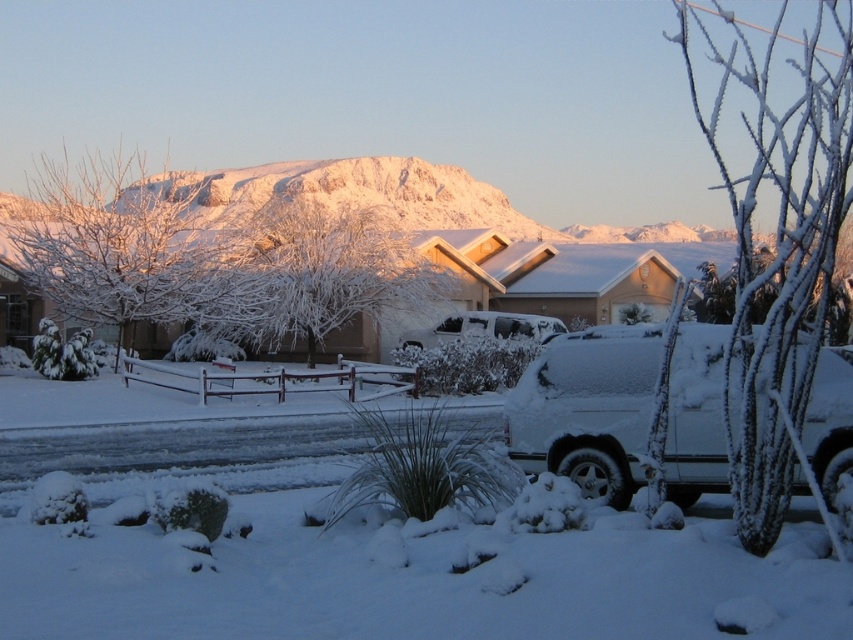
Question: Does white matte suv at center appear on the left side of white matte car at center?

Choices:
 (A) no
 (B) yes

Answer: (A)

Question: Is white matte suv at center to the left of white matte car at center from the viewer's perspective?

Choices:
 (A) no
 (B) yes

Answer: (A)

Question: Among these objects, which one is farthest from the camera?

Choices:
 (A) white matte suv at center
 (B) white matte car at center

Answer: (B)

Question: Is white matte suv at center to the left of white matte car at center from the viewer's perspective?

Choices:
 (A) no
 (B) yes

Answer: (A)

Question: Which point is closer to the camera?

Choices:
 (A) (838, 387)
 (B) (489, 314)

Answer: (A)

Question: Which point is farther to the camera?

Choices:
 (A) white matte suv at center
 (B) white matte car at center

Answer: (B)